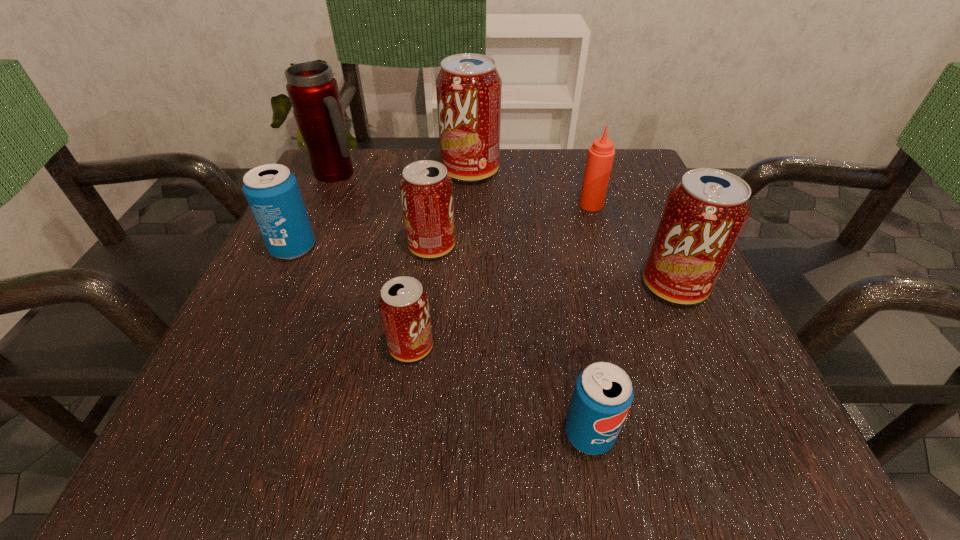
Identify the location of blank area located 0.370m on the right of the second nearest object. (687, 347).

You are a GUI agent. You are given a task and a screenshot of the screen. Output one action in this format:
    pyautogui.click(x=<x>, y=<y>)
    Task: Click on the free region located on the left of the nearest soda can
    Image resolution: width=960 pixels, height=540 pixels.
    Given the screenshot: What is the action you would take?
    pyautogui.click(x=411, y=434)

Image resolution: width=960 pixels, height=540 pixels. In order to click on soda can positioned at the far edge in this screenshot , I will do `click(468, 87)`.

Locate an element on the screen. This screenshot has width=960, height=540. thermos bottle at the far edge is located at coordinates (313, 92).

Locate an element on the screen. Tabasco sauce that is at the far edge is located at coordinates (601, 154).

What are the coordinates of `object that is at the near edge` in the screenshot? It's located at [x=603, y=394].

This screenshot has height=540, width=960. In order to click on thermos bottle located in the left edge section of the desktop in this screenshot , I will do `click(313, 92)`.

The width and height of the screenshot is (960, 540). I want to click on soda can that is positioned at the left edge, so click(x=272, y=192).

Find the location of `soda can at the right edge`. soda can at the right edge is located at coordinates (705, 213).

The image size is (960, 540). What are the coordinates of `Tabasco sauce that is at the right edge` in the screenshot? It's located at (601, 154).